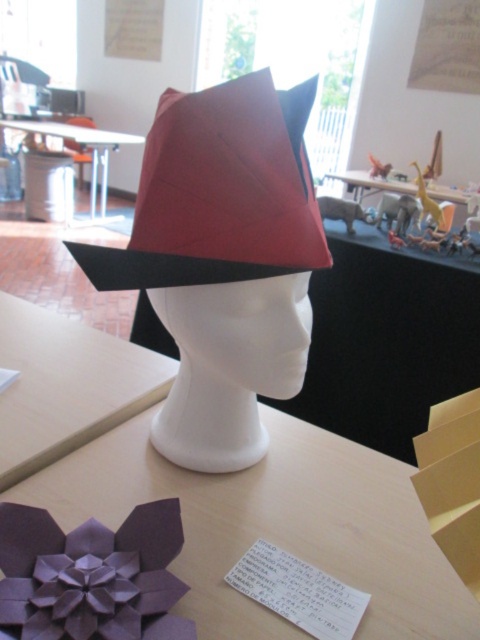
You are organizing a craft fair and need to place the purple paper flower at center and the matte white table at center on a display. Which object should be placed to the left to maintain the original positioning?

The matte white table at center should be placed to the left because the purple paper flower at center is originally to the right of it.

You are an art student who needs to place a small origami crane on the table between the matte paper hat at center and the wooden at center. Based on their positions, which object should the crane be closer to?

The matte paper hat at center is to the right of the wooden at center, so the crane should be placed closer to the wooden at center to maintain balance between them.

From the picture: You are a student in the classroom and want to reach the matte paper hat at center on the table without moving any other items. If your hand can extend 60 centimeters, will you be able to touch it?

The matte paper hat at center is 63.65 centimeters away from the viewer, which is beyond the 60 centimeter reach of your hand. Therefore, you cannot touch the matte paper hat at center without moving other items.